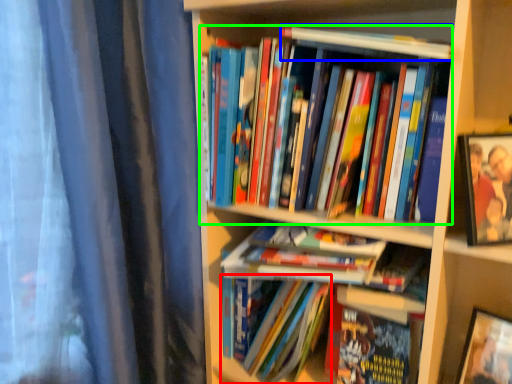
Question: Considering the real-world distances, which object is farthest from book (highlighted by a red box)? book (highlighted by a blue box) or book (highlighted by a green box)?

Choices:
 (A) book
 (B) book

Answer: (A)